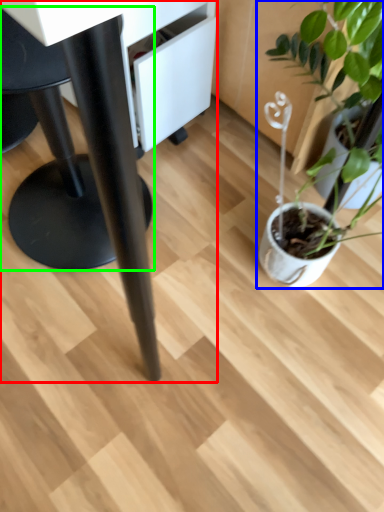
Question: Which object is positioned farthest from table (highlighted by a red box)? Select from houseplant (highlighted by a blue box) and swivel chair (highlighted by a green box).

Choices:
 (A) houseplant
 (B) swivel chair

Answer: (A)